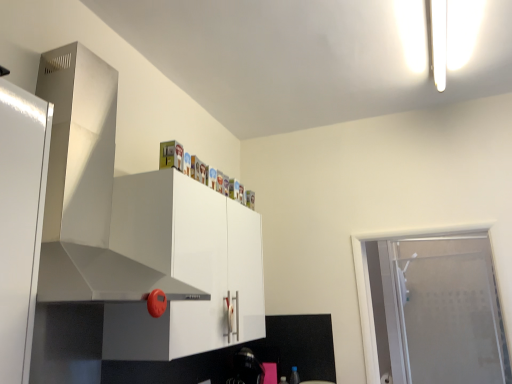
Question: Should I look upward or downward to see white glossy cabinet at upper center?

Choices:
 (A) down
 (B) up

Answer: (A)

Question: From the image's perspective, would you say stainless steel exhaust hood at upper left is shown under frosted glass door at right?

Choices:
 (A) yes
 (B) no

Answer: (B)

Question: Does stainless steel exhaust hood at upper left contain frosted glass door at right?

Choices:
 (A) yes
 (B) no

Answer: (B)

Question: From a real-world perspective, is stainless steel exhaust hood at upper left below frosted glass door at right?

Choices:
 (A) no
 (B) yes

Answer: (A)

Question: Considering the relative positions of stainless steel exhaust hood at upper left and frosted glass door at right in the image provided, is stainless steel exhaust hood at upper left to the right of frosted glass door at right from the viewer's perspective?

Choices:
 (A) yes
 (B) no

Answer: (B)

Question: Is stainless steel exhaust hood at upper left not near frosted glass door at right?

Choices:
 (A) no
 (B) yes

Answer: (B)

Question: Can you confirm if stainless steel exhaust hood at upper left is wider than frosted glass door at right?

Choices:
 (A) yes
 (B) no

Answer: (A)

Question: Considering the relative sizes of white glossy cabinet at upper center and frosted glass door at right in the image provided, is white glossy cabinet at upper center shorter than frosted glass door at right?

Choices:
 (A) yes
 (B) no

Answer: (A)

Question: Are white glossy cabinet at upper center and frosted glass door at right far apart?

Choices:
 (A) yes
 (B) no

Answer: (A)

Question: From the image's perspective, is white glossy cabinet at upper center located beneath frosted glass door at right?

Choices:
 (A) no
 (B) yes

Answer: (A)

Question: Is white glossy cabinet at upper center further to camera compared to frosted glass door at right?

Choices:
 (A) yes
 (B) no

Answer: (B)

Question: Would you say frosted glass door at right is part of white glossy cabinet at upper center's contents?

Choices:
 (A) yes
 (B) no

Answer: (B)

Question: Is white glossy cabinet at upper center positioned with its back to frosted glass door at right?

Choices:
 (A) yes
 (B) no

Answer: (B)

Question: Is frosted glass door at right positioned far away from stainless steel exhaust hood at upper left?

Choices:
 (A) yes
 (B) no

Answer: (A)